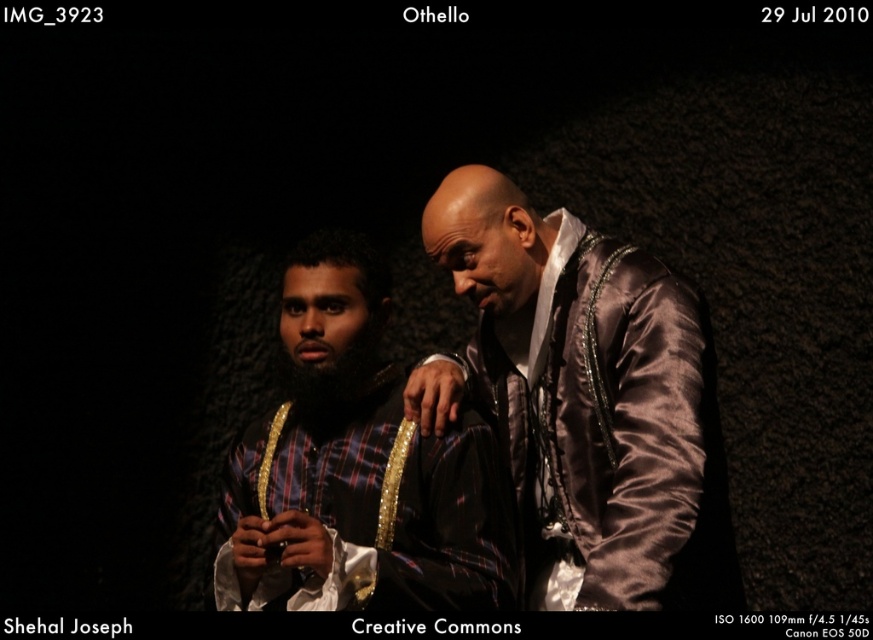
Who is shorter, satin brown jacket at center or plaid fabric shirt at center?

plaid fabric shirt at center is shorter.

Does point (452, 392) come farther from viewer compared to point (335, 440)?

No.

Describe the element at coordinates (585, 397) in the screenshot. I see `satin brown jacket at center` at that location.

Where is `satin brown jacket at center`? The width and height of the screenshot is (873, 640). satin brown jacket at center is located at coordinates (585, 397).